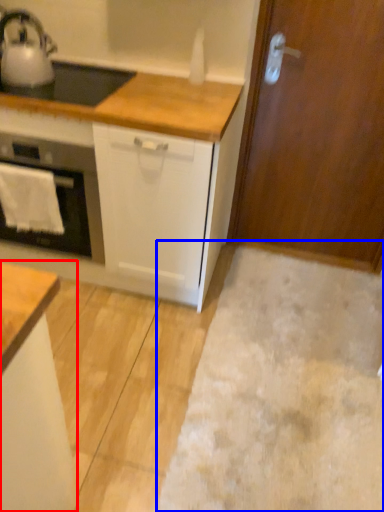
Question: Which object appears farthest to the camera in this image, cabinetry (highlighted by a red box) or plain (highlighted by a blue box)?

Choices:
 (A) cabinetry
 (B) plain

Answer: (B)